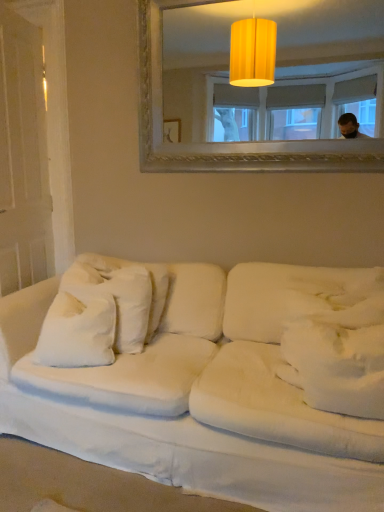
Question: Does white fabric couch at lower center appear on the right side of white soft pillow at left, placed as the 2th pillow when sorted from front to back?

Choices:
 (A) no
 (B) yes

Answer: (B)

Question: Is white soft pillow at left, which is the 1th pillow from back to front, located within white fabric couch at lower center?

Choices:
 (A) no
 (B) yes

Answer: (B)

Question: Does white fabric couch at lower center have a lesser width compared to white soft pillow at left, which is the 1th pillow from back to front?

Choices:
 (A) no
 (B) yes

Answer: (A)

Question: Does white fabric couch at lower center have a greater height compared to white soft pillow at left, placed as the 2th pillow when sorted from front to back?

Choices:
 (A) yes
 (B) no

Answer: (A)

Question: From the image's perspective, is white fabric couch at lower center below white soft pillow at left, acting as the 2th pillow starting from the right?

Choices:
 (A) yes
 (B) no

Answer: (A)

Question: From the image's perspective, is white soft pillow at left, placed as the 2th pillow when sorted from front to back, located above or below white fabric couch at lower center?

Choices:
 (A) above
 (B) below

Answer: (A)

Question: Is white soft pillow at left, which is the 1th pillow from back to front, wider or thinner than white fabric couch at lower center?

Choices:
 (A) thin
 (B) wide

Answer: (A)

Question: Is white soft pillow at left, placed as the 2th pillow when sorted from front to back, bigger or smaller than white fabric couch at lower center?

Choices:
 (A) small
 (B) big

Answer: (A)

Question: Would you say white soft pillow at left, which is the 1th pillow from back to front, is to the left or to the right of white fabric couch at lower center in the picture?

Choices:
 (A) right
 (B) left

Answer: (B)

Question: Based on their sizes in the image, would you say white fabric couch at lower center is bigger or smaller than white soft pillow at left, placed as the 2th pillow when sorted from front to back?

Choices:
 (A) big
 (B) small

Answer: (A)

Question: From their relative heights in the image, would you say white fabric couch at lower center is taller or shorter than white soft pillow at left, acting as the 1th pillow starting from the left?

Choices:
 (A) short
 (B) tall

Answer: (B)

Question: Considering the positions of point (336, 458) and point (127, 294), is point (336, 458) closer or farther from the camera than point (127, 294)?

Choices:
 (A) closer
 (B) farther

Answer: (A)

Question: Is white fabric couch at lower center to the left or to the right of white soft pillow at left, placed as the 2th pillow when sorted from front to back, in the image?

Choices:
 (A) right
 (B) left

Answer: (A)

Question: Is white soft pillow at center, the 1th pillow positioned from the front, wider or thinner than white soft pillow at left, which is the 1th pillow from back to front?

Choices:
 (A) thin
 (B) wide

Answer: (A)

Question: In the image, is white soft pillow at center, the 1th pillow positioned from the front, positioned in front of or behind white soft pillow at left, placed as the 2th pillow when sorted from front to back?

Choices:
 (A) behind
 (B) front

Answer: (B)